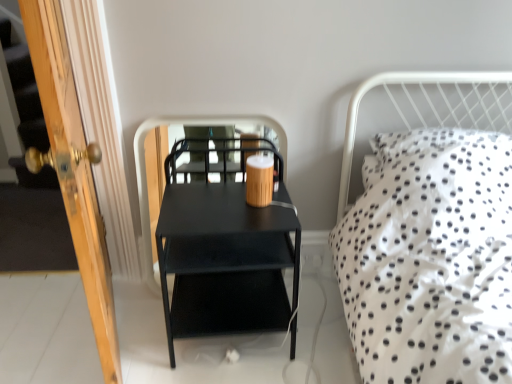
Question: In terms of width, does black matte side table at center look wider or thinner when compared to wooden coffee cup at center?

Choices:
 (A) thin
 (B) wide

Answer: (B)

Question: Based on their sizes in the image, would you say black matte side table at center is bigger or smaller than wooden coffee cup at center?

Choices:
 (A) big
 (B) small

Answer: (A)

Question: Which of these objects is positioned closest to the wooden door at left?

Choices:
 (A) matte black nightstand at center
 (B) wooden coffee cup at center
 (C) black matte side table at center

Answer: (A)

Question: Estimate the real-world distances between objects in this image. Which object is farther from the wooden door at left?

Choices:
 (A) matte black nightstand at center
 (B) wooden coffee cup at center
 (C) black matte side table at center

Answer: (C)